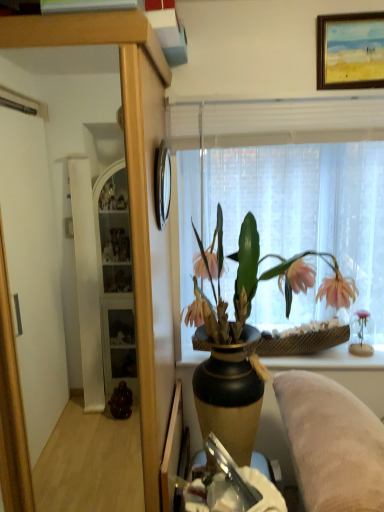
You are a GUI agent. You are given a task and a screenshot of the screen. Output one action in this format:
    pyautogui.click(x=<x>, y=<y>)
    Task: Click on the empty space that is ontop of translucent fabric at upper center (from a real-world perspective)
    The width and height of the screenshot is (384, 512).
    Given the screenshot: What is the action you would take?
    pyautogui.click(x=300, y=88)